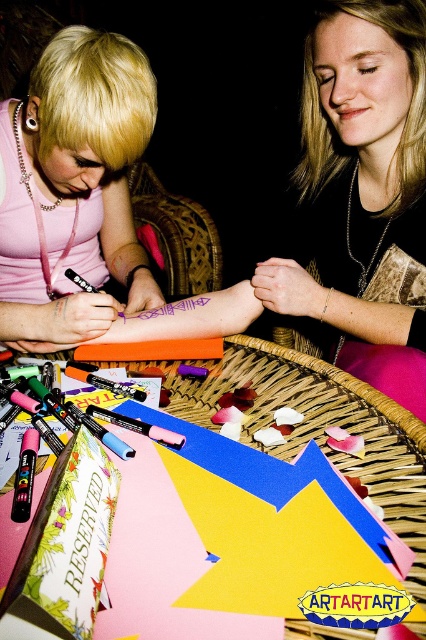
Does pink paper at center appear on the left side of orange matte crayon at center?

Incorrect, pink paper at center is not on the left side of orange matte crayon at center.

Between pink paper at center and orange matte crayon at center, which one is positioned higher?

orange matte crayon at center is above.

Who is more distant from viewer, (x=363, y=403) or (x=166, y=340)?

Positioned behind is point (x=166, y=340).

What are the coordinates of `pink paper at center` in the screenshot? It's located at 313,416.

Does blonde hair at upper left have a larger size compared to orange matte crayon at center?

Indeed, blonde hair at upper left has a larger size compared to orange matte crayon at center.

Does blonde hair at upper left appear on the left side of orange matte crayon at center?

In fact, blonde hair at upper left is to the right of orange matte crayon at center.

Identify the location of blonde hair at upper left. (354, 204).

Where is `blonde hair at upper left`? The image size is (426, 640). blonde hair at upper left is located at coordinates (354, 204).

Does blonde hair at upper left appear on the right side of matte pink shirt at upper left?

Yes, blonde hair at upper left is to the right of matte pink shirt at upper left.

Measure the distance between blonde hair at upper left and camera.

They are 75.69 centimeters apart.

Is point (344, 209) behind point (17, 342)?

Yes, it is.

Where is `blonde hair at upper left`? This screenshot has width=426, height=640. blonde hair at upper left is located at coordinates (354, 204).